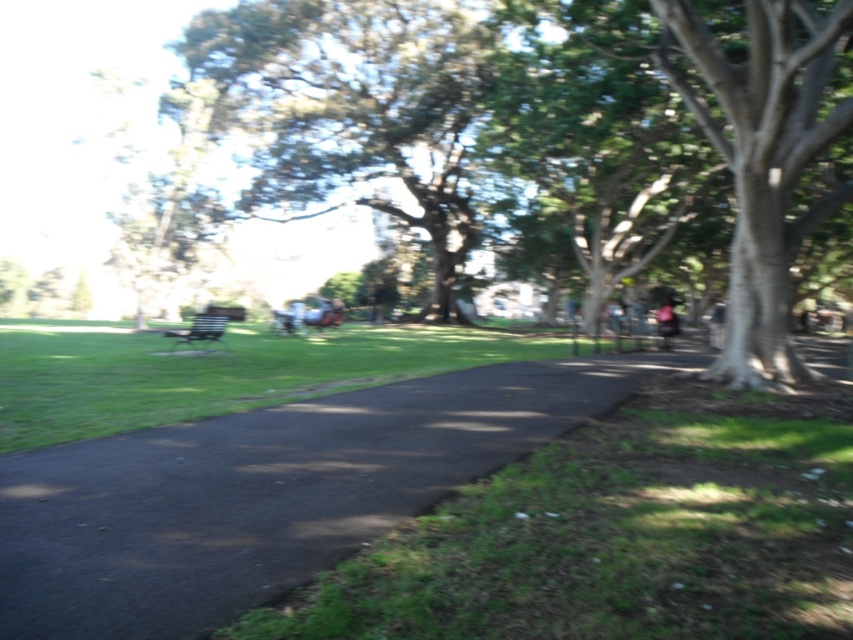
You are standing at the center of the paved pathway in the park. You want to reach the green grass at lower right. According to the coordinates provided, in which direction should you walk to get there?

The green grass at lower right is located at point coordinates, so you should walk towards the lower right direction to reach it.

You are a pedestrian walking in the park and want to stay in the shade. Which area should you walk towards, the black asphalt pavement at center or the green leafy tree at upper center?

The black asphalt pavement at center is positioned under green leafy tree at upper center, so walking towards the black asphalt pavement at center would place you in the shade provided by the tree.

Based on the coordinates provided, what is located at point (260, 493) in the park scene?

The point (260, 493) in the park scene indicates black asphalt pavement at center.